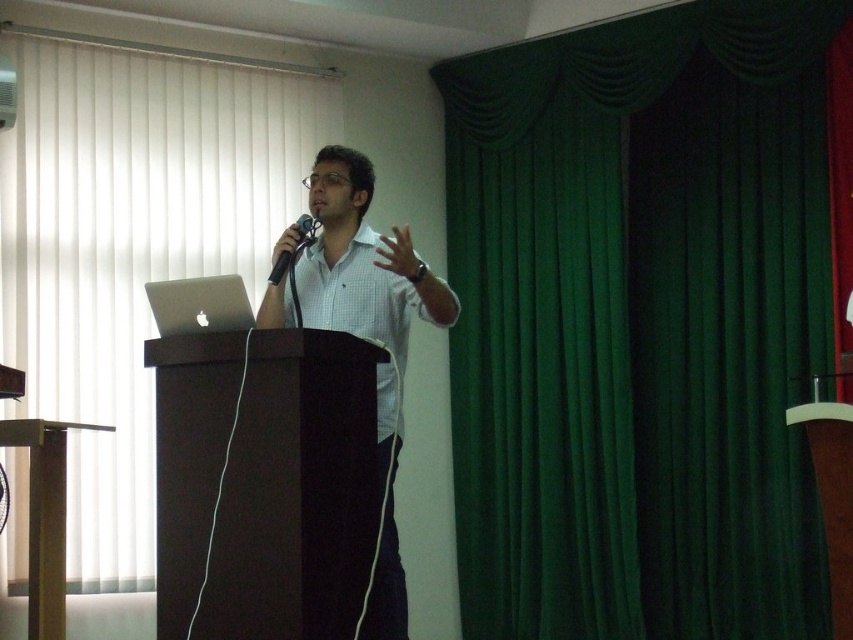
You are an event organizer who needs to set up a stage for a speaker. The stage currently has the dark wood podium at center and the black matte microphone at center. Which object should you adjust if you want to make sure the microphone is more prominent than the podium?

Since the dark wood podium at center is currently larger in size than the black matte microphone at center, to make the microphone more prominent, you should adjust the size of the podium to be smaller or the microphone to be larger.

You are an interior designer who needs to place a new painting exactly at the point where the green fabric curtain at upper right is located. What object is currently occupying that location?

The green fabric curtain at upper right is currently occupying the location at point (132, 248).